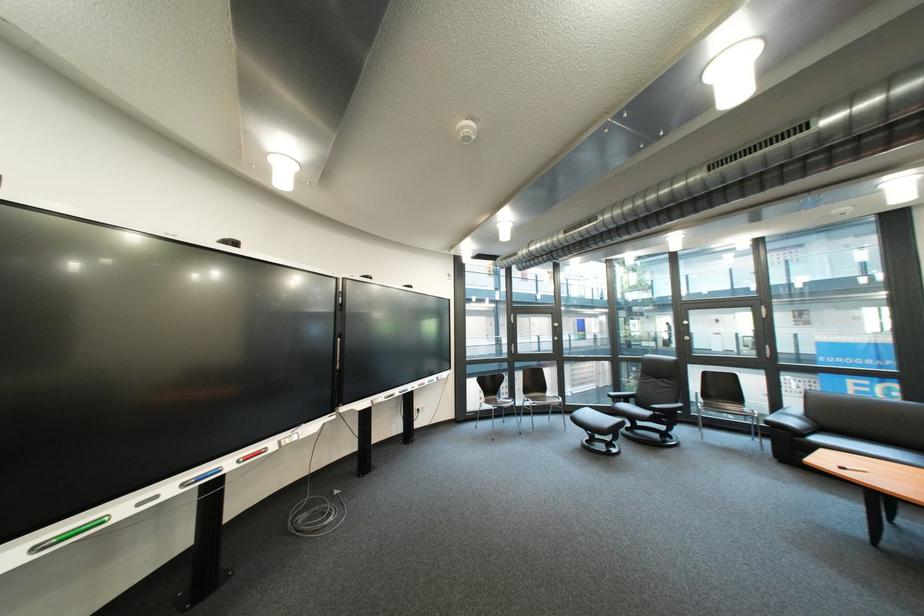
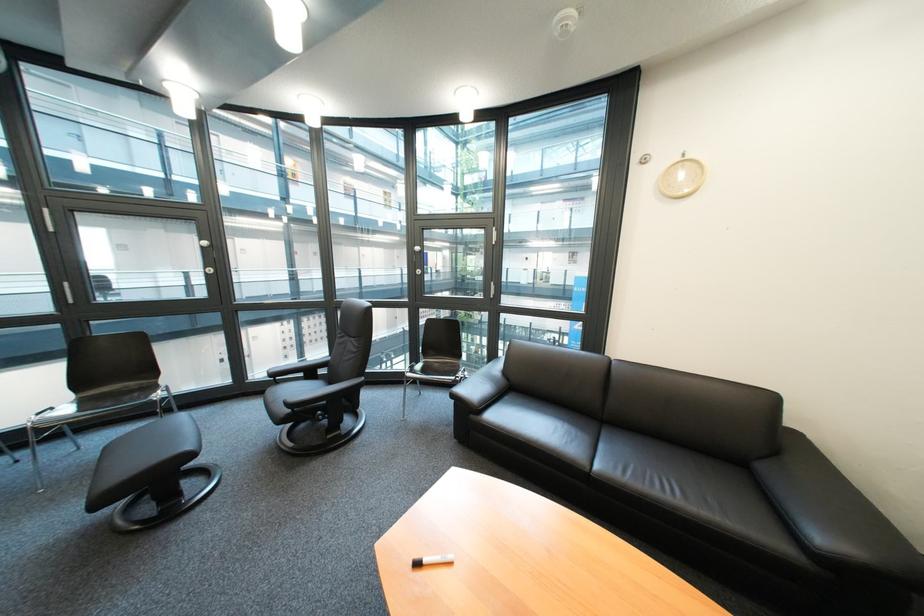
Find the pixel in the second image that matches (811,440) in the first image.

(485, 418)